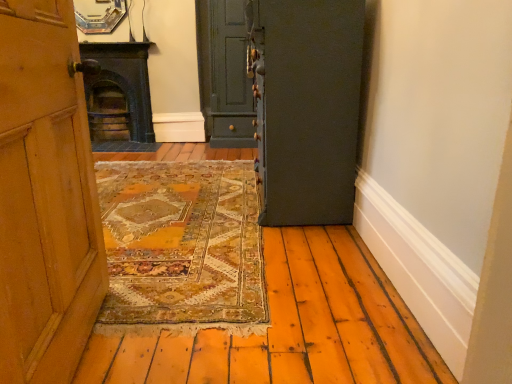
What do you see at coordinates (229, 78) in the screenshot? I see `matte green door at center, placed as the first door when sorted from back to front` at bounding box center [229, 78].

The height and width of the screenshot is (384, 512). What do you see at coordinates (119, 97) in the screenshot?
I see `dark green stone fireplace at left` at bounding box center [119, 97].

Image resolution: width=512 pixels, height=384 pixels. Identify the location of matte green door at center, marked as the second door in a front-to-back arrangement. (229, 78).

Is dark gray matte door at center, the 2th door viewed from the back, further to camera compared to matte green door at center, which ranks as the 1th door in left-to-right order?

No, the depth of dark gray matte door at center, the 2th door viewed from the back, is less than that of matte green door at center, which ranks as the 1th door in left-to-right order.

The image size is (512, 384). In order to click on door above the dark gray matte door at center, the 2th door viewed from the back (from the image's perspective) in this screenshot , I will do `click(229, 78)`.

What's the angular difference between dark gray matte door at center, which ranks as the 2th door in left-to-right order, and matte green door at center, placed as the first door when sorted from back to front,'s facing directions?

They differ by 89.9 degrees in their facing directions.

Can we say dark gray matte door at center, which ranks as the 2th door in left-to-right order, lies outside matte green door at center, placed as the first door when sorted from back to front?

Indeed, dark gray matte door at center, which ranks as the 2th door in left-to-right order, is completely outside matte green door at center, placed as the first door when sorted from back to front.

Identify the location of fireplace behind the dark gray matte door at center, the 2th door viewed from the back. This screenshot has width=512, height=384. pyautogui.click(x=119, y=97).

From the picture: Considering the sizes of objects dark green stone fireplace at left and dark gray matte door at center, the 2th door viewed from the back, in the image provided, who is wider, dark green stone fireplace at left or dark gray matte door at center, the 2th door viewed from the back,?

Wider between the two is dark gray matte door at center, the 2th door viewed from the back.

From a real-world perspective, which object rests below the other?

dark green stone fireplace at left.

The height and width of the screenshot is (384, 512). I want to click on door that is the 2nd one when counting rightward from the dark green stone fireplace at left, so tap(305, 107).

From the image's perspective, is dark gray matte door at center, the 1th door from the front, located above dark green stone fireplace at left?

No, from the image's perspective, dark gray matte door at center, the 1th door from the front, is not over dark green stone fireplace at left.

Between point (265, 113) and point (120, 42), which one is positioned in front?

The point (265, 113) is in front.

From a real-world perspective, is matte green door at center, placed as the first door when sorted from back to front, on dark gray matte door at center, the 2th door viewed from the back?

Yes, from a real-world perspective, matte green door at center, placed as the first door when sorted from back to front, is above dark gray matte door at center, the 2th door viewed from the back.

Is matte green door at center, marked as the second door in a front-to-back arrangement, not close to dark gray matte door at center, the 1th door from the front?

Yes.

How much distance is there between matte green door at center, which ranks as the 1th door in left-to-right order, and dark gray matte door at center, the 1th door from the front?

They are 5.73 feet apart.

From the image's perspective, who appears lower, matte green door at center, placed as the second door when sorted from right to left, or dark gray matte door at center, which appears as the 1th door when viewed from the right?

dark gray matte door at center, which appears as the 1th door when viewed from the right, from the image's perspective.

Is matte green door at center, marked as the second door in a front-to-back arrangement, not near dark green stone fireplace at left?

That's not correct — matte green door at center, marked as the second door in a front-to-back arrangement, is a little close to dark green stone fireplace at left.

The image size is (512, 384). I want to click on door above the dark green stone fireplace at left (from the image's perspective), so click(x=229, y=78).

Which is closer, (239, 94) or (87, 92)?

Point (239, 94)

Could you measure the distance between dark green stone fireplace at left and matte green door at center, marked as the second door in a front-to-back arrangement?

dark green stone fireplace at left is 34.43 inches from matte green door at center, marked as the second door in a front-to-back arrangement.

Based on the photo, who is more distant, dark green stone fireplace at left or matte green door at center, placed as the second door when sorted from right to left?

dark green stone fireplace at left.

Which point is more forward, (121, 144) or (234, 35)?

Positioned in front is point (234, 35).

Is dark green stone fireplace at left positioned beyond the bounds of matte green door at center, placed as the first door when sorted from back to front?

Absolutely, dark green stone fireplace at left is external to matte green door at center, placed as the first door when sorted from back to front.

This screenshot has height=384, width=512. I want to click on door on the left side of dark gray matte door at center, which ranks as the 2th door in left-to-right order, so click(229, 78).

Where is `door that is the 2nd object to the right of the dark green stone fireplace at left, starting at the anchor`? The width and height of the screenshot is (512, 384). door that is the 2nd object to the right of the dark green stone fireplace at left, starting at the anchor is located at coordinates (305, 107).

From the image, which object appears to be farther from dark green stone fireplace at left, dark gray matte door at center, the 2th door viewed from the back, or matte green door at center, marked as the second door in a front-to-back arrangement?

Among the two, dark gray matte door at center, the 2th door viewed from the back, is located further to dark green stone fireplace at left.

Considering their positions, is dark green stone fireplace at left positioned closer to matte green door at center, marked as the second door in a front-to-back arrangement, than dark gray matte door at center, the 2th door viewed from the back?

Among the two, dark green stone fireplace at left is located nearer to matte green door at center, marked as the second door in a front-to-back arrangement.

Looking at the image, which one is located closer to dark gray matte door at center, which appears as the 1th door when viewed from the right, dark green stone fireplace at left or matte green door at center, which ranks as the 1th door in left-to-right order?

matte green door at center, which ranks as the 1th door in left-to-right order, lies closer to dark gray matte door at center, which appears as the 1th door when viewed from the right, than the other object.

In the scene shown: Considering their positions, is matte green door at center, placed as the first door when sorted from back to front, positioned closer to dark green stone fireplace at left than dark gray matte door at center, which appears as the 1th door when viewed from the right?

Based on the image, matte green door at center, placed as the first door when sorted from back to front, appears to be nearer to dark green stone fireplace at left.

Which object lies nearer to the anchor point dark gray matte door at center, the 1th door from the front, matte green door at center, placed as the second door when sorted from right to left, or dark green stone fireplace at left?

matte green door at center, placed as the second door when sorted from right to left, lies closer to dark gray matte door at center, the 1th door from the front, than the other object.

Looking at the image, which one is located further to matte green door at center, placed as the second door when sorted from right to left, dark gray matte door at center, the 2th door viewed from the back, or dark green stone fireplace at left?

dark gray matte door at center, the 2th door viewed from the back, lies further to matte green door at center, placed as the second door when sorted from right to left, than the other object.

Where is `door between dark gray matte door at center, which appears as the 1th door when viewed from the right, and dark green stone fireplace at left, along the z-axis`? The height and width of the screenshot is (384, 512). door between dark gray matte door at center, which appears as the 1th door when viewed from the right, and dark green stone fireplace at left, along the z-axis is located at coordinates (229, 78).